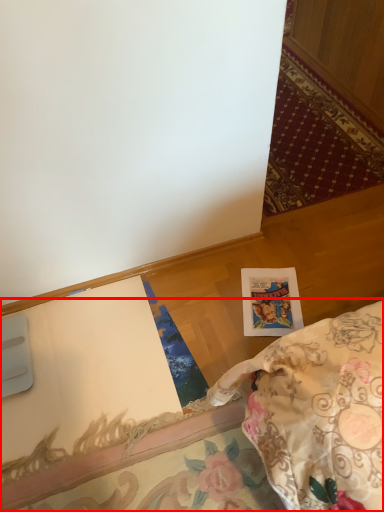
Question: From the image's perspective, what is the correct spatial relationship of furniture (annotated by the red box) in relation to postcard?

Choices:
 (A) below
 (B) above

Answer: (A)